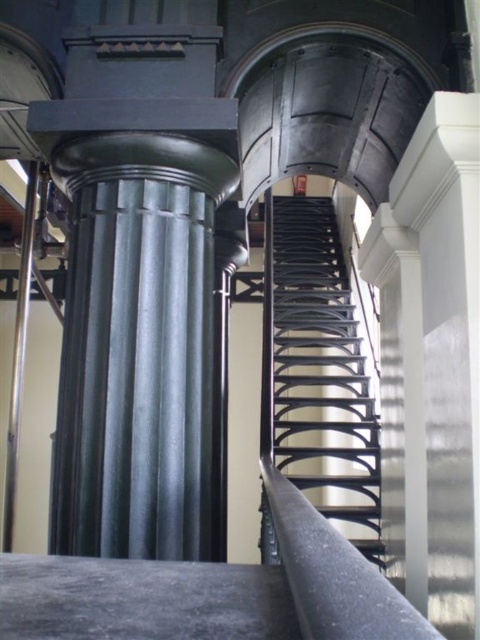
Is black metal staircase at center wider than silver metallic pole at left?

Indeed, black metal staircase at center has a greater width compared to silver metallic pole at left.

Describe the element at coordinates (317, 372) in the screenshot. This screenshot has width=480, height=640. I see `black metal staircase at center` at that location.

Looking at this image, who is more forward, (294, 289) or (20, 292)?

Point (20, 292) is in front.

Locate an element on the screen. The image size is (480, 640). black metal staircase at center is located at coordinates (317, 372).